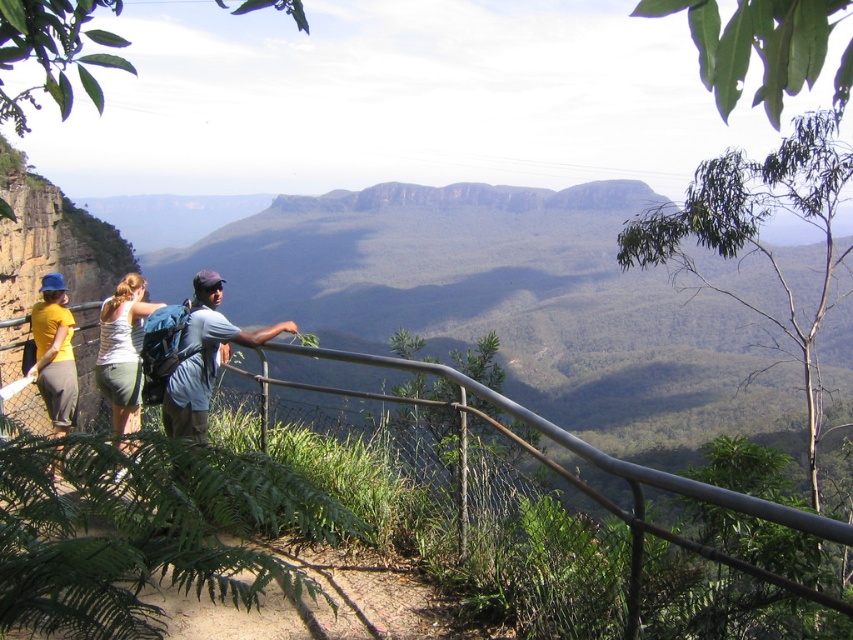
Does light blue t-shirt at center appear under yellow matte shirt at left?

Incorrect, light blue t-shirt at center is not positioned below yellow matte shirt at left.

Is point (231, 336) positioned in front of point (51, 282)?

Yes, it is.

Between point (285, 328) and point (61, 364), which one is positioned in front?

Point (285, 328) is in front.

Locate an element on the screen. The width and height of the screenshot is (853, 640). light blue t-shirt at center is located at coordinates (204, 356).

Is metallic gray rail at upper center positioned at the back of white cotton tank top at center?

That is True.

At what (x,y) coordinates should I click in order to perform the action: click on metallic gray rail at upper center. Please return your answer as a coordinate pair (x, y). The height and width of the screenshot is (640, 853). Looking at the image, I should click on (560, 468).

In the scene shown: Who is taller, metallic gray rail at upper center or yellow matte shirt at left?

Standing taller between the two is metallic gray rail at upper center.

Between metallic gray rail at upper center and yellow matte shirt at left, which one appears on the right side from the viewer's perspective?

metallic gray rail at upper center is more to the right.

Which is behind, point (297, 384) or point (39, 314)?

The point (39, 314) is more distant.

At what (x,y) coordinates should I click in order to perform the action: click on metallic gray rail at upper center. Please return your answer as a coordinate pair (x, y). Looking at the image, I should click on (560, 468).